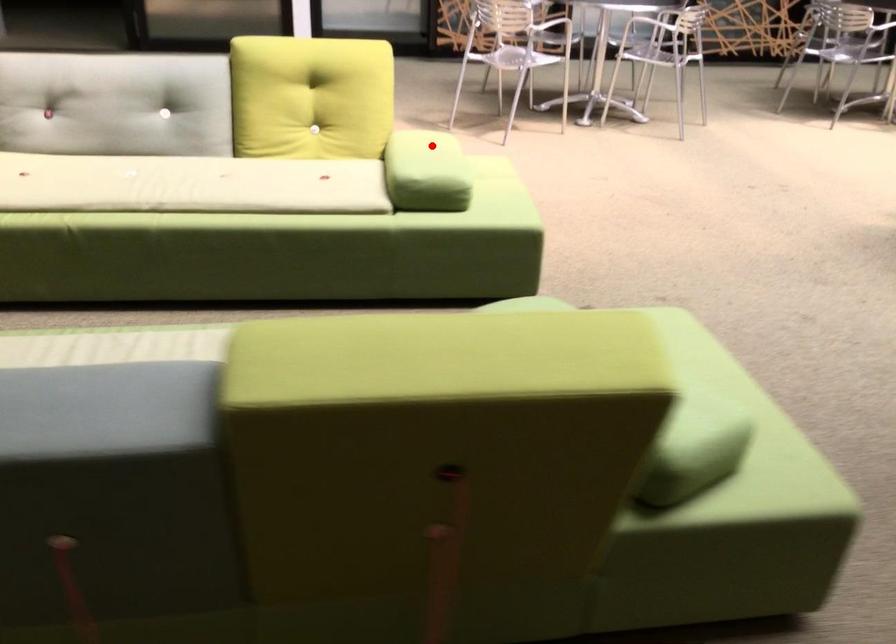
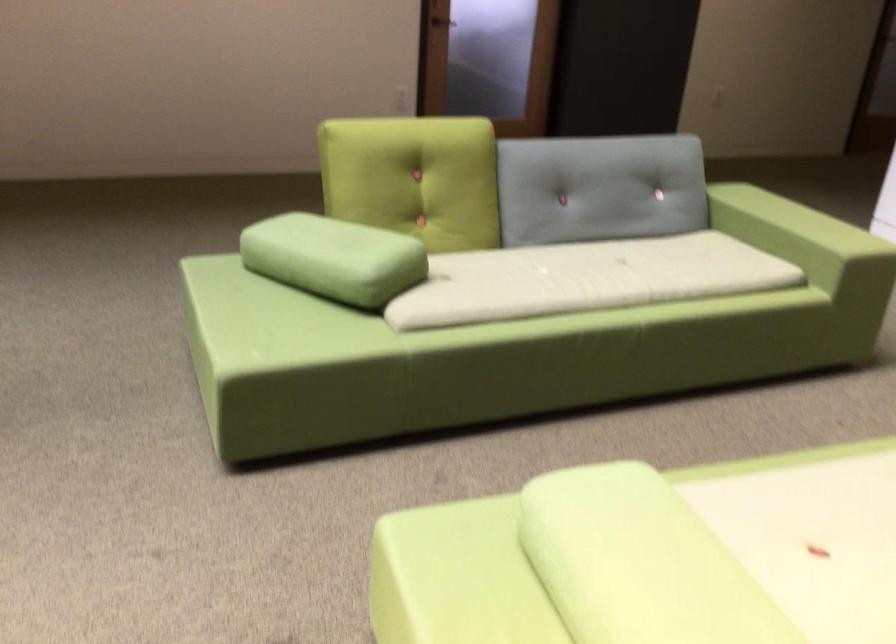
Question: I am providing you with two images of the same scene from different viewpoints. A red point is shown in image1. For the corresponding object point in image2, is it positioned nearer or farther from the camera?

Choices:
 (A) Nearer
 (B) Farther

Answer: (A)